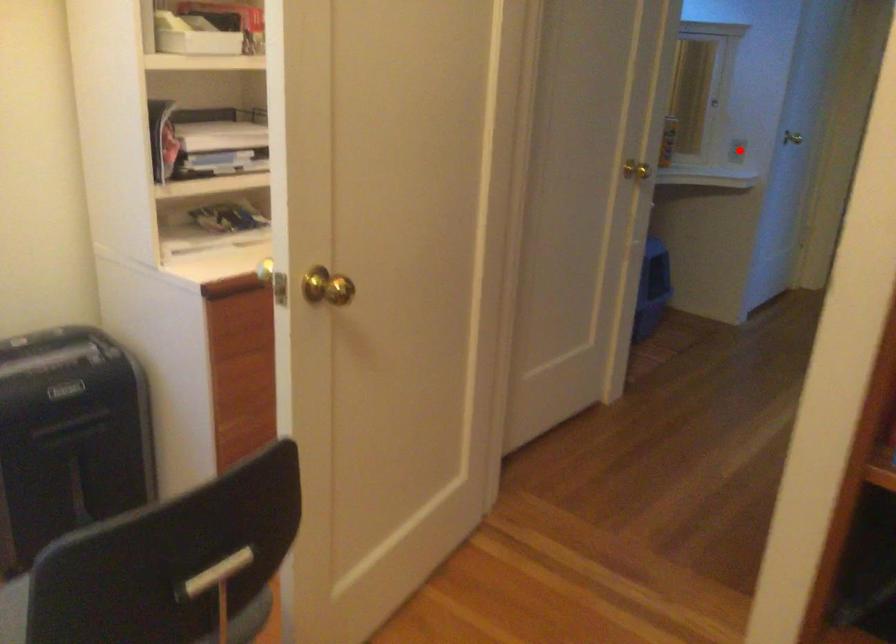
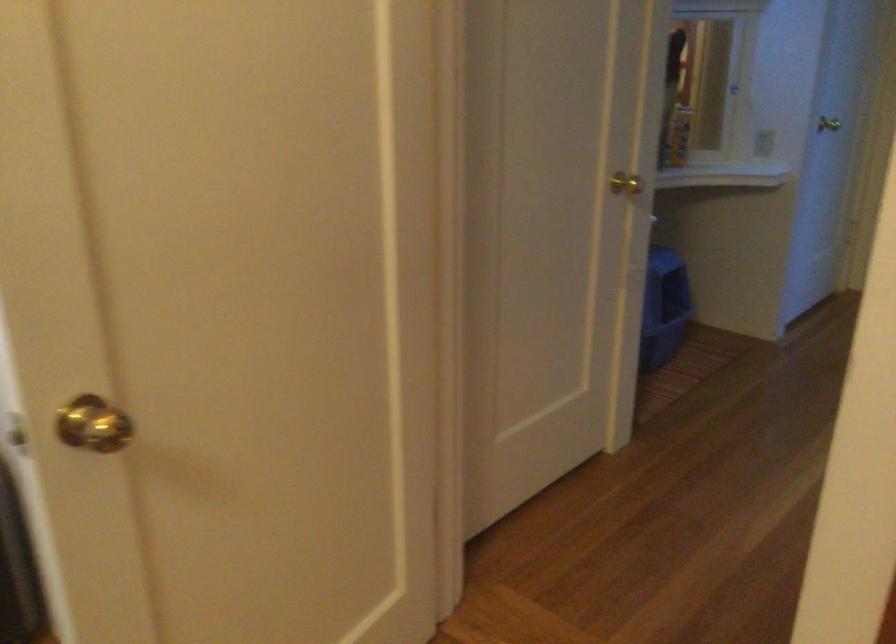
The point at the highlighted location is marked in the first image. Where is the corresponding point in the second image?

(762, 143)